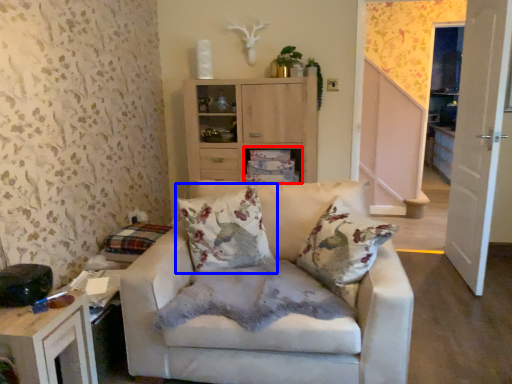
Question: Which object is further to the camera taking this photo, shelf (highlighted by a red box) or pillow (highlighted by a blue box)?

Choices:
 (A) shelf
 (B) pillow

Answer: (A)